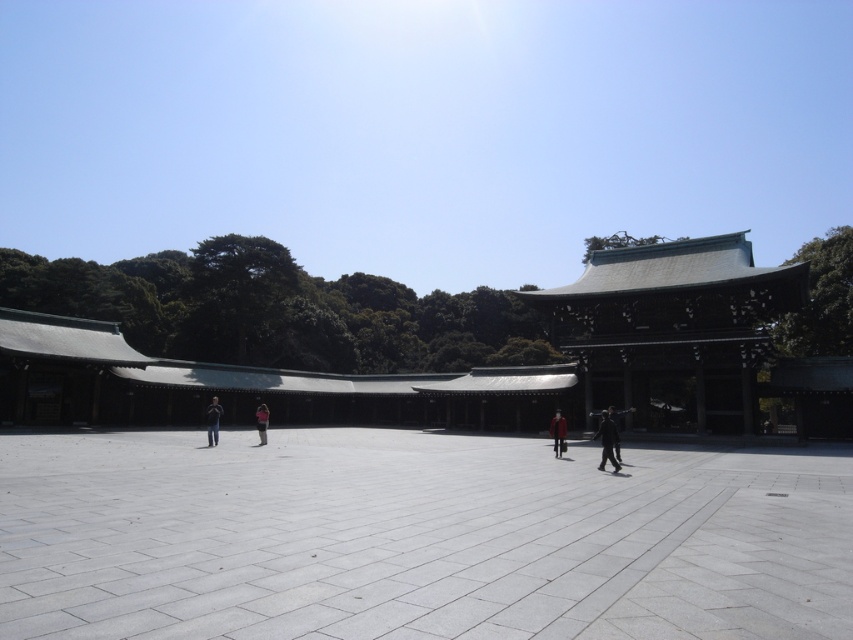
Is point (91, 440) positioned after point (262, 433)?

Yes, point (91, 440) is behind point (262, 433).

Can you confirm if gray concrete courtyard at center is positioned above pink fabric person at center?

Yes.

The width and height of the screenshot is (853, 640). What do you see at coordinates (416, 538) in the screenshot? I see `gray concrete courtyard at center` at bounding box center [416, 538].

Locate an element on the screen. Image resolution: width=853 pixels, height=640 pixels. gray concrete courtyard at center is located at coordinates (416, 538).

Is gray concrete courtyard at center to the left of green wooden temple at center from the viewer's perspective?

Indeed, gray concrete courtyard at center is positioned on the left side of green wooden temple at center.

This screenshot has height=640, width=853. What are the coordinates of `gray concrete courtyard at center` in the screenshot? It's located at (416, 538).

You are a GUI agent. You are given a task and a screenshot of the screen. Output one action in this format:
    pyautogui.click(x=<x>, y=<y>)
    Task: Click on the gray concrete courtyard at center
    
    Given the screenshot: What is the action you would take?
    pyautogui.click(x=416, y=538)

Does green wooden temple at center have a smaller size compared to dark gray fabric jacket at center?

No, green wooden temple at center is not smaller than dark gray fabric jacket at center.

Between green wooden temple at center and dark gray fabric jacket at center, which one is positioned lower?

dark gray fabric jacket at center is below.

Which is in front, point (631, 352) or point (610, 424)?

Point (610, 424)

You are a GUI agent. You are given a task and a screenshot of the screen. Output one action in this format:
    pyautogui.click(x=<x>, y=<y>)
    Task: Click on the green wooden temple at center
    This screenshot has height=640, width=853.
    Given the screenshot: What is the action you would take?
    pyautogui.click(x=674, y=324)